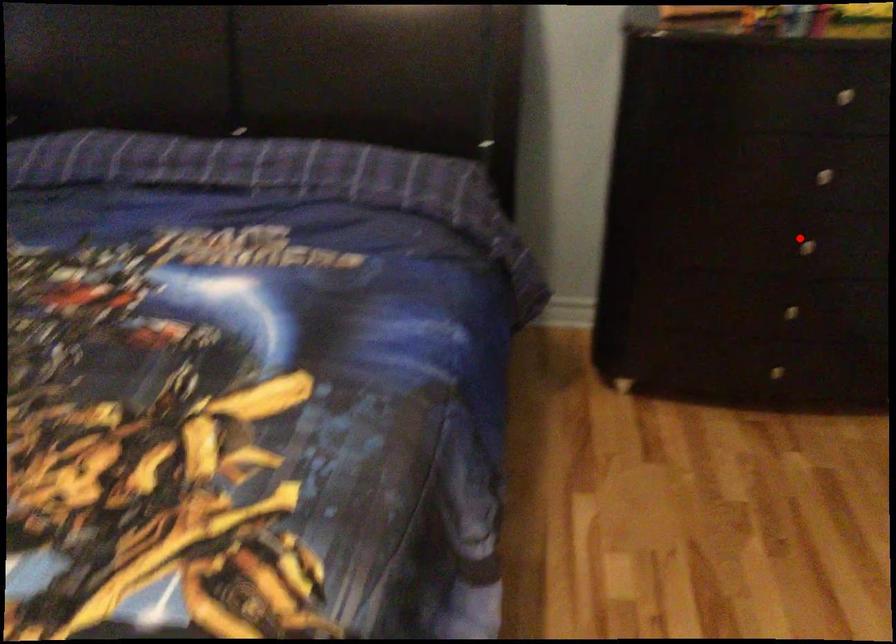
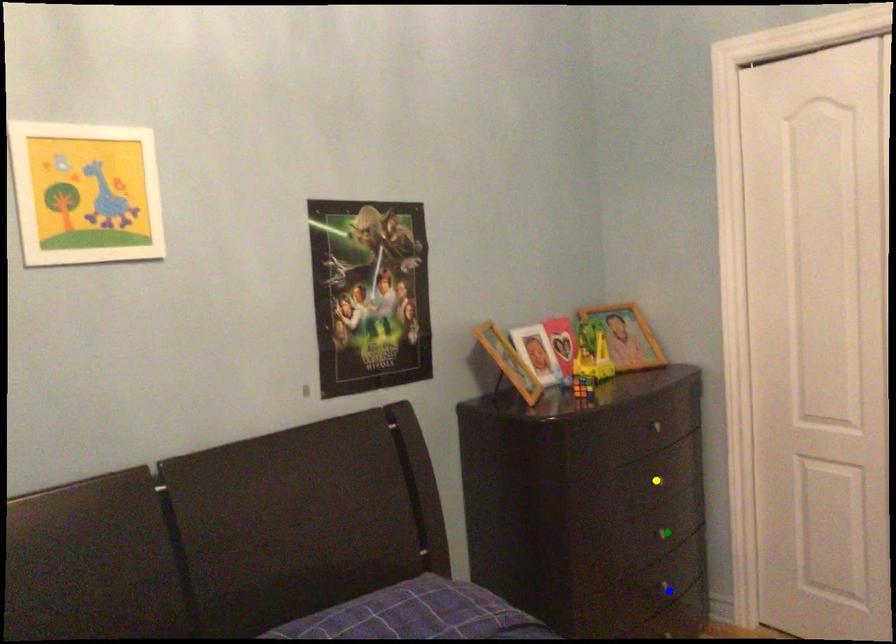
Question: I am providing you with two images of the same scene from different viewpoints. A red point is marked on the first image. You are given multiple points on the second image. Which mark in image 2 goes with the point in image 1?

Choices:
 (A) yellow point
 (B) green point
 (C) blue point

Answer: (B)